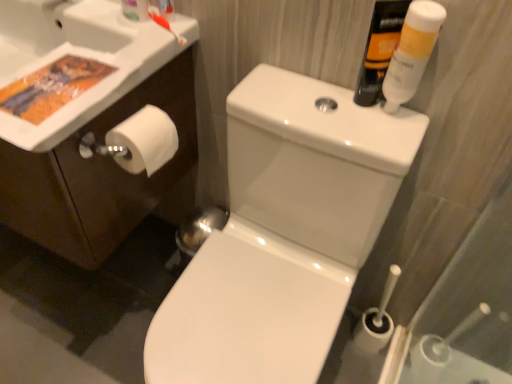
Locate an element on the screen. The image size is (512, 384). free space in front of translucent plastic mouthwash at upper right, the second mouthwash when ordered from right to left is located at coordinates (357, 120).